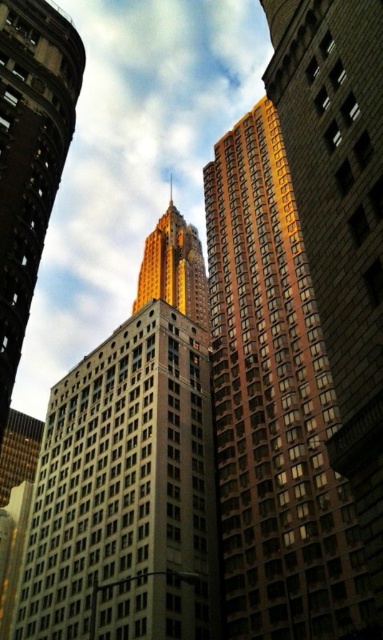
Question: Can you confirm if white concrete building at center is wider than matte glass skyscraper at center?

Choices:
 (A) yes
 (B) no

Answer: (A)

Question: Which object is the farthest from the gold reflective skyscraper at center?

Choices:
 (A) brown brick building at center
 (B) white concrete building at center

Answer: (B)

Question: Which object is the farthest from the matte glass skyscraper at center?

Choices:
 (A) brown brick building at center
 (B) gold reflective skyscraper at center
 (C) white concrete building at center

Answer: (B)

Question: Does brown brick building at center lie in front of matte glass skyscraper at center?

Choices:
 (A) no
 (B) yes

Answer: (B)

Question: Is brown brick building at center above matte glass skyscraper at center?

Choices:
 (A) yes
 (B) no

Answer: (B)

Question: Which point is closer to the camera?

Choices:
 (A) (201, 538)
 (B) (14, 106)
 (C) (158, 273)

Answer: (B)